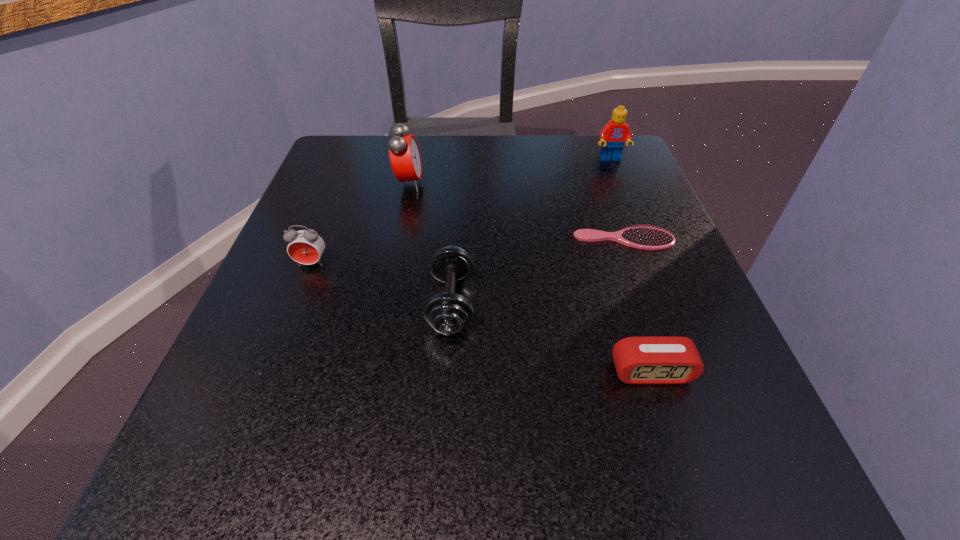
I want to click on the shortest object, so click(x=646, y=238).

Find the location of a particular element. vacant space located 0.150m on the face of the farthest object is located at coordinates (629, 204).

Identify the location of vacant region located on the front-facing side of the second alarm clock from left to right. This screenshot has width=960, height=540. (617, 184).

Identify the location of blank space located on the face of the second farthest alarm clock. This screenshot has height=540, width=960. (268, 375).

Locate an element on the screen. This screenshot has height=540, width=960. free point located 0.180m on the front of the fourth object from right to left is located at coordinates (441, 481).

What are the coordinates of `vacant space located on the front-facing side of the rightmost alarm clock` in the screenshot? It's located at (681, 462).

The height and width of the screenshot is (540, 960). What are the coordinates of `free space located 0.240m on the back of the shortest object` in the screenshot? It's located at (596, 161).

Where is `Lego that is at the far edge`? This screenshot has width=960, height=540. Lego that is at the far edge is located at coordinates click(x=614, y=134).

Locate an element on the screen. The image size is (960, 540). alarm clock that is at the far edge is located at coordinates (405, 158).

At what (x,y) coordinates should I click in order to perform the action: click on object that is at the left edge. Please return your answer as a coordinate pair (x, y). The image size is (960, 540). Looking at the image, I should click on (305, 247).